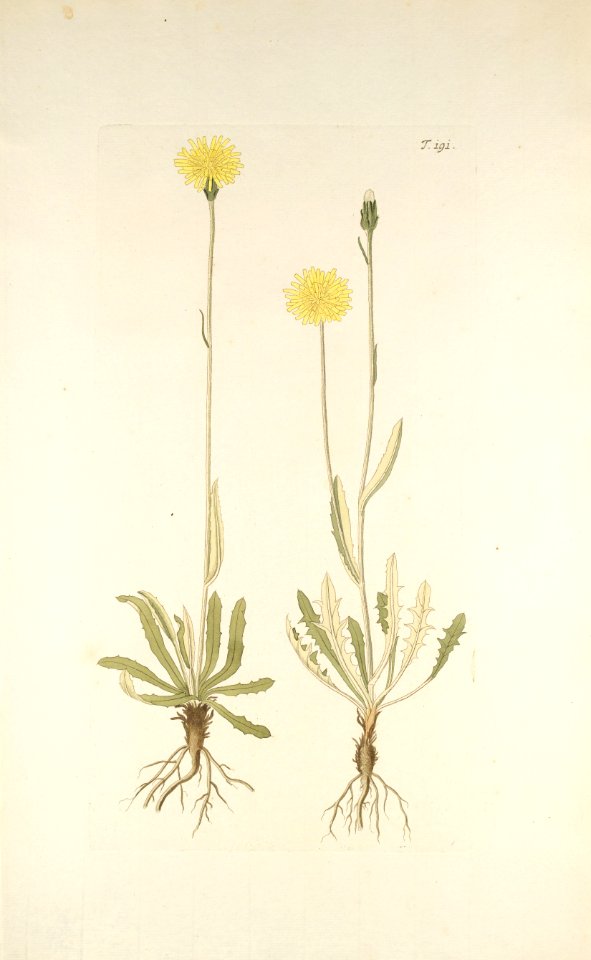
The height and width of the screenshot is (960, 591). What are the coordinates of `corners` in the screenshot? It's located at (574, 946), (14, 948), (20, 20), (578, 10).